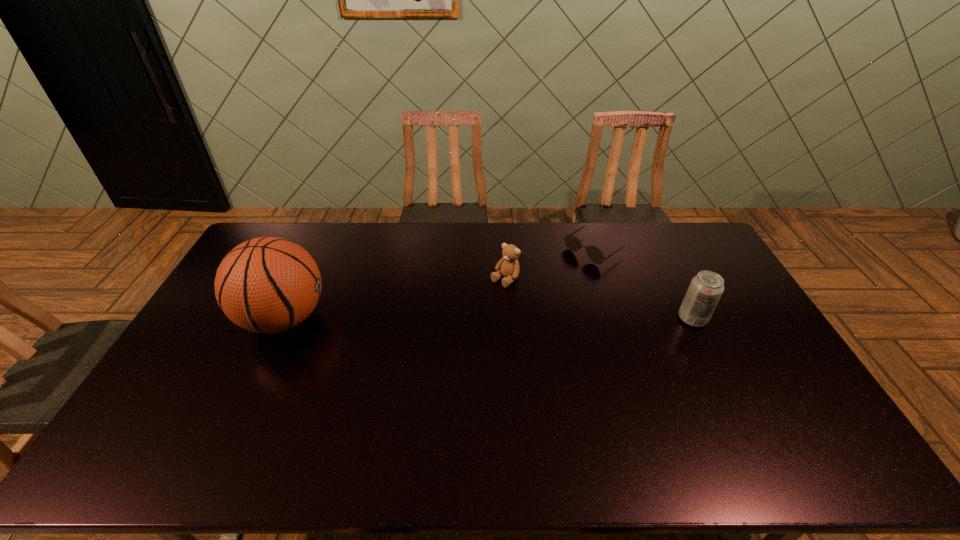
Where is `the leftmost object`? the leftmost object is located at coordinates (268, 285).

This screenshot has height=540, width=960. What are the coordinates of `the tallest object` in the screenshot? It's located at (268, 285).

Image resolution: width=960 pixels, height=540 pixels. Find the location of `soda can`. soda can is located at coordinates (706, 288).

Locate an element on the screen. The width and height of the screenshot is (960, 540). the rightmost object is located at coordinates (706, 288).

The image size is (960, 540). I want to click on sunglasses, so click(x=572, y=243).

This screenshot has height=540, width=960. What are the coordinates of `the second object from right to left` in the screenshot? It's located at (572, 243).

At what (x,y) coordinates should I click in order to perform the action: click on the second shortest object. Please return your answer as a coordinate pair (x, y). Looking at the image, I should click on (508, 266).

Where is `the second object from left to right`? The height and width of the screenshot is (540, 960). the second object from left to right is located at coordinates (508, 266).

I want to click on vacant space located 0.370m on the side where the inflation valve is located, so click(x=444, y=319).

Where is `vacant region located on the back of the second tallest object`? vacant region located on the back of the second tallest object is located at coordinates (662, 259).